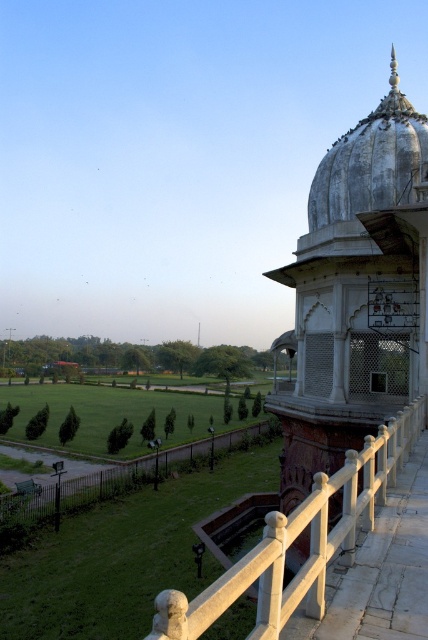
Who is positioned more to the right, white stone railing at lower right or white stone railing at lower center?

white stone railing at lower right is more to the right.

Who is positioned more to the left, white stone railing at lower right or white stone railing at lower center?

white stone railing at lower center

Is point (276, 572) farther from camera compared to point (228, 440)?

No, it is in front of (228, 440).

This screenshot has height=640, width=428. I want to click on white stone railing at lower right, so coord(297,538).